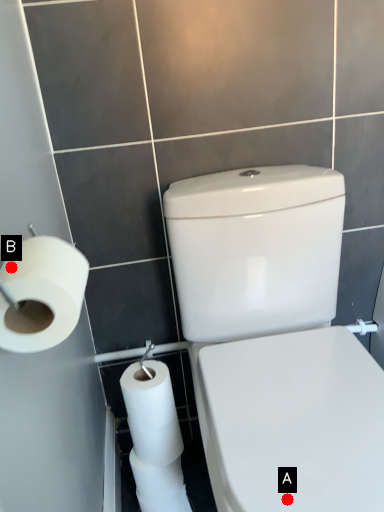
Question: Two points are circled on the image, labeled by A and B beside each circle. Which point is closer to the camera?

Choices:
 (A) A is closer
 (B) B is closer

Answer: (B)